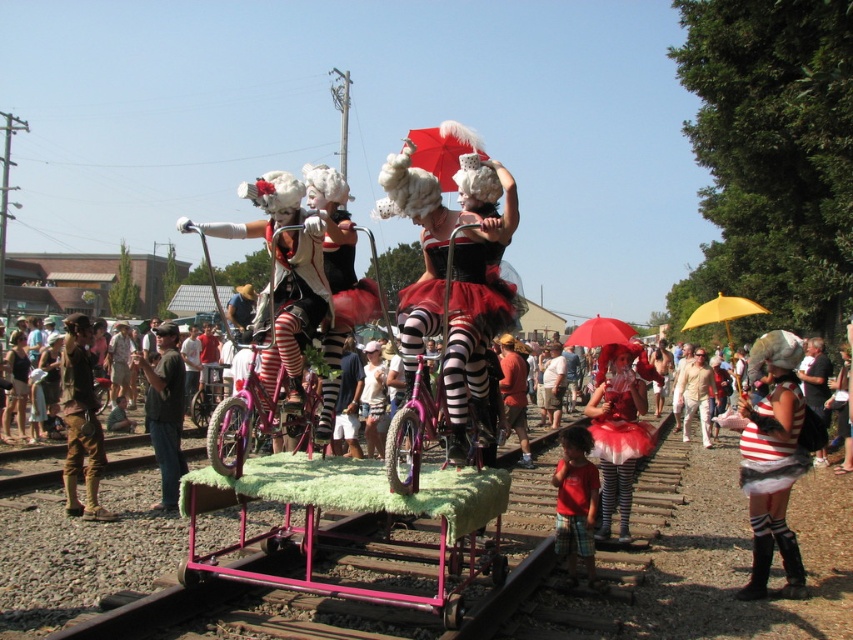
Is point (762, 524) closer to viewer compared to point (769, 401)?

Yes, it is in front of point (769, 401).

Is striped fabric dress at center in front of striped fabric dress at right?

No, it is behind striped fabric dress at right.

The image size is (853, 640). I want to click on striped fabric dress at center, so click(772, 460).

Can you confirm if matte black tutu at center is positioned to the left of matte red dress at center?

Correct, you'll find matte black tutu at center to the left of matte red dress at center.

The image size is (853, 640). I want to click on matte black tutu at center, so click(480, 288).

This screenshot has height=640, width=853. I want to click on matte black tutu at center, so click(x=480, y=288).

At what (x,y) coordinates should I click in order to perform the action: click on matte black tutu at center. Please return your answer as a coordinate pair (x, y). Image resolution: width=853 pixels, height=640 pixels. Looking at the image, I should click on (480, 288).

In the scene shown: Is red cotton shirt at lower center taller than yellow matte umbrella at upper right?

No.

Can you confirm if red cotton shirt at lower center is positioned to the right of yellow matte umbrella at upper right?

No, red cotton shirt at lower center is not to the right of yellow matte umbrella at upper right.

Between point (563, 520) and point (701, 323), which one is positioned behind?

Point (701, 323)

Where is `red cotton shirt at lower center`? This screenshot has width=853, height=640. red cotton shirt at lower center is located at coordinates pos(575,502).